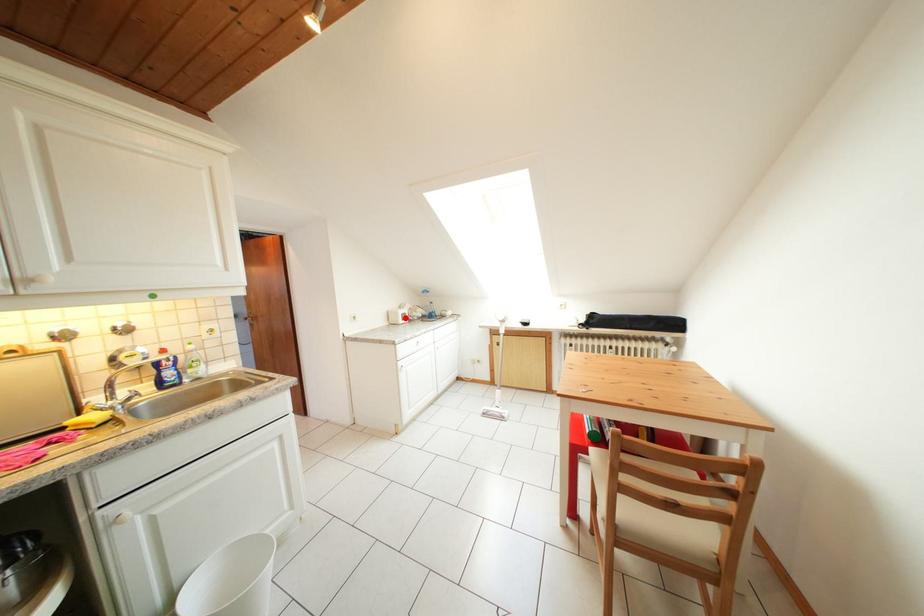
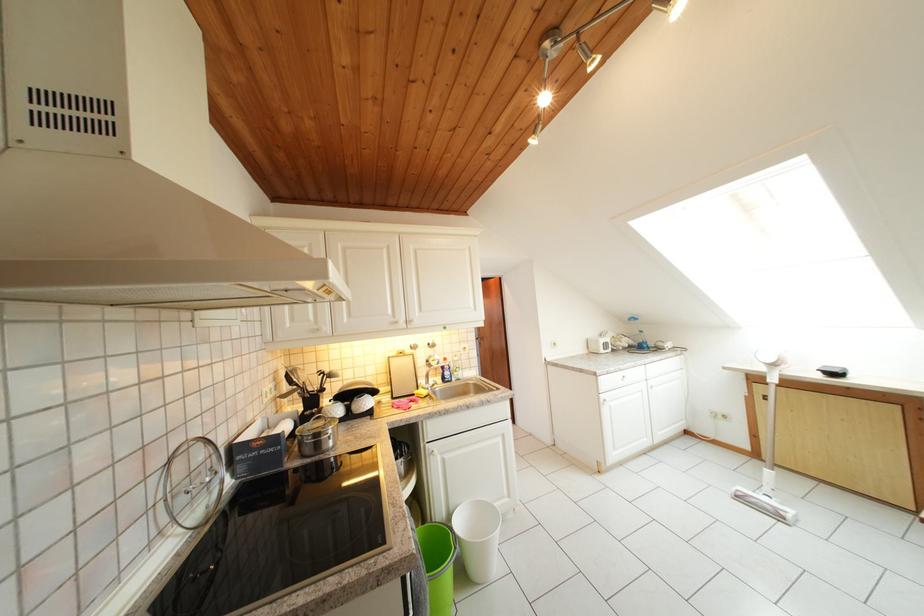
Where in the second image is the point corresponding to the highlighted location from the first image?

(605, 347)